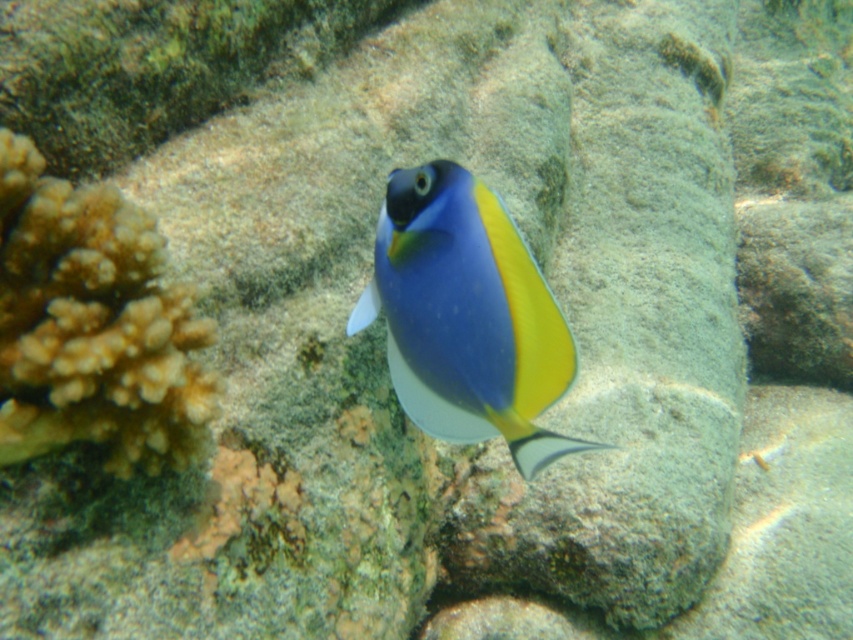
You are a scuba diver observing the underwater scene. You notice the brown textured coral at left and the matte blue fish at center. Which object is positioned higher in the water column?

The brown textured coral at left is positioned higher in the water column than the matte blue fish at center.

You are a marine biologist observing an underwater scene. You notice a specific point at coordinates point (26, 401) in the image. If your underwater camera has a focal length of 30 inches, can you estimate whether this point is closer or farther than the focal length from your camera lens?

The distance of point (26, 401) from viewer is 29.42 inches, which is slightly less than the camera lens focal length of 30 inches. Therefore, the point is closer than the focal length.